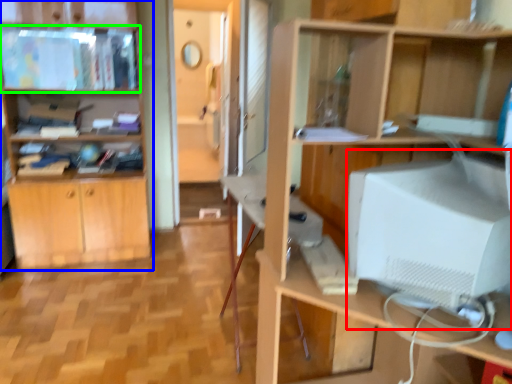
Question: Which object is positioned closest to computer monitor (highlighted by a red box)? Select from cabinetry (highlighted by a blue box) and cabinet (highlighted by a green box).

Choices:
 (A) cabinetry
 (B) cabinet

Answer: (A)